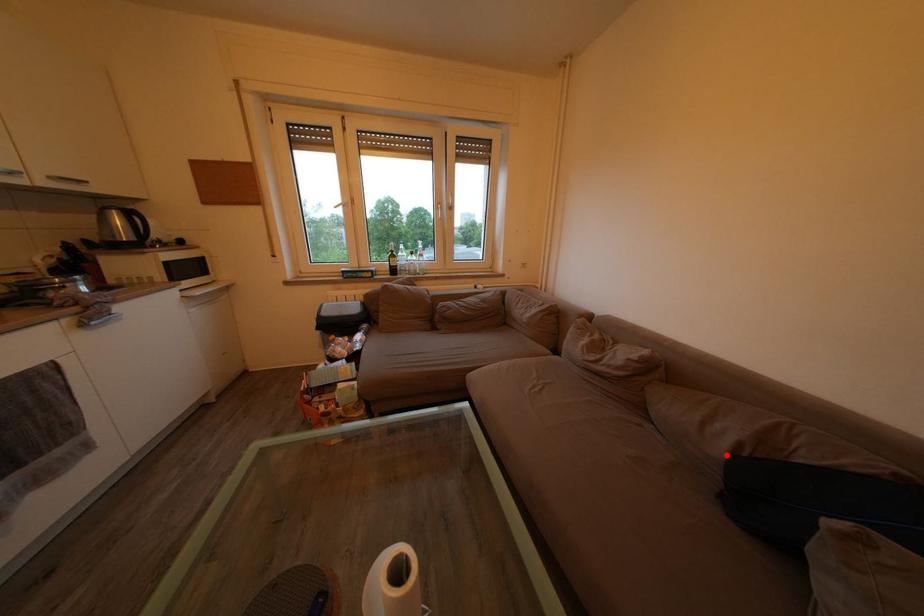
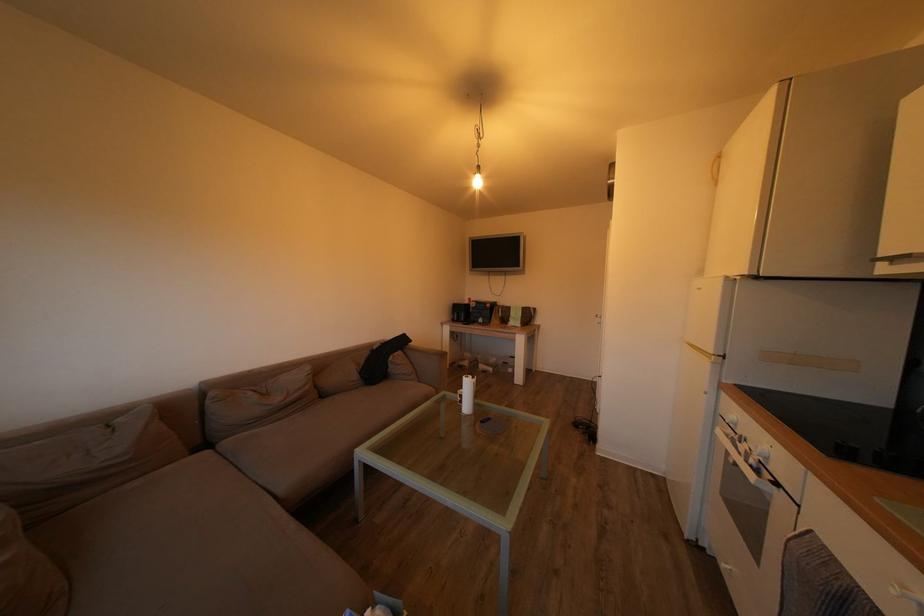
Where in the second image is the point corresponding to the highlighted location from the first image?

(362, 382)